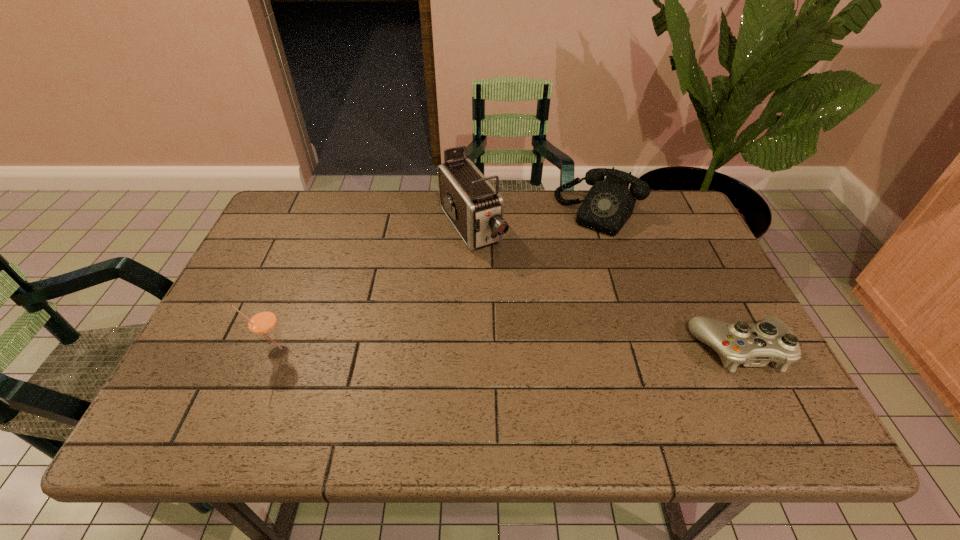
I want to click on telephone that is positioned at the right edge, so (x=609, y=204).

Where is `object located at the near left corner`? This screenshot has width=960, height=540. object located at the near left corner is located at coordinates (262, 322).

Locate an element on the screen. The width and height of the screenshot is (960, 540). object located in the far right corner section of the desktop is located at coordinates (609, 204).

In order to click on object that is at the near right corner in this screenshot , I will do `click(754, 345)`.

Find the location of a particular element. Image resolution: width=960 pixels, height=540 pixels. vacant area at the far edge of the desktop is located at coordinates (386, 227).

Where is `free space at the near edge of the desktop`? free space at the near edge of the desktop is located at coordinates (524, 381).

You are a GUI agent. You are given a task and a screenshot of the screen. Output one action in this format:
    pyautogui.click(x=<x>, y=<y>)
    Task: Click on the vacant space at the left edge of the desktop
    This screenshot has width=960, height=540.
    Given the screenshot: What is the action you would take?
    pyautogui.click(x=223, y=313)

What are the coordinates of `vacant region at the right edge of the desktop` in the screenshot? It's located at (689, 241).

Identify the location of free location at the far left corner. The height and width of the screenshot is (540, 960). (315, 204).

Locate an element on the screen. The image size is (960, 540). vacant region at the near left corner of the desktop is located at coordinates (251, 368).